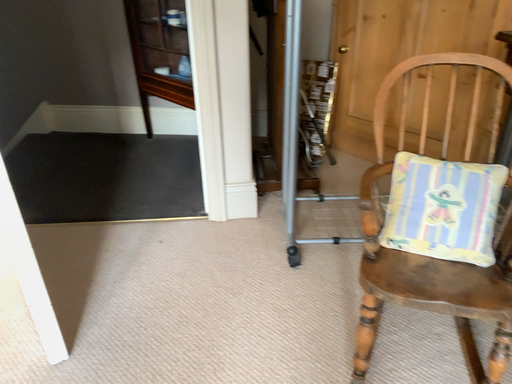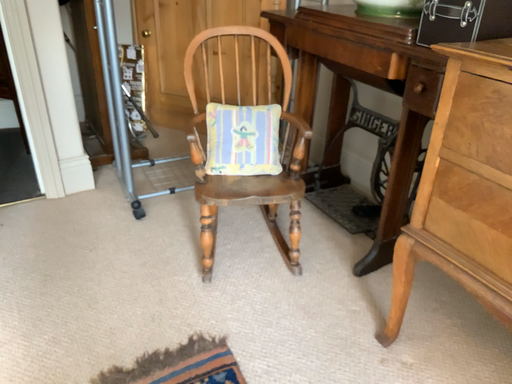
Question: Which way did the camera rotate in the video?

Choices:
 (A) rotated right
 (B) rotated left

Answer: (A)